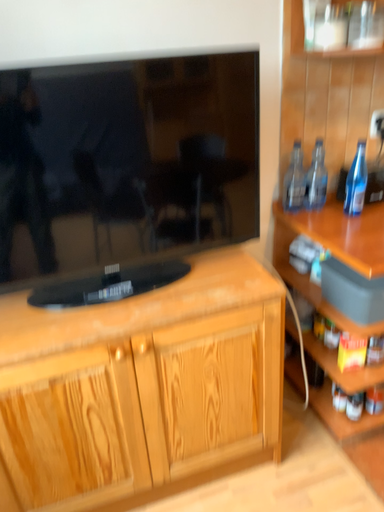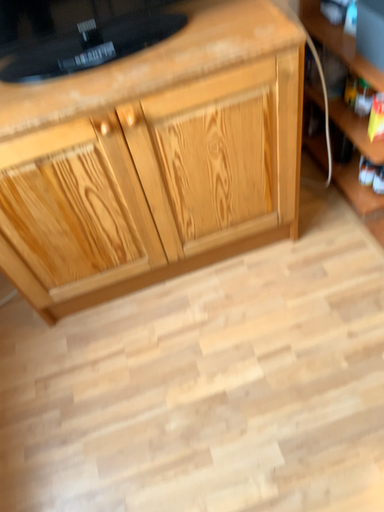
Question: Which way did the camera rotate in the video?

Choices:
 (A) rotated downward
 (B) rotated upward

Answer: (A)